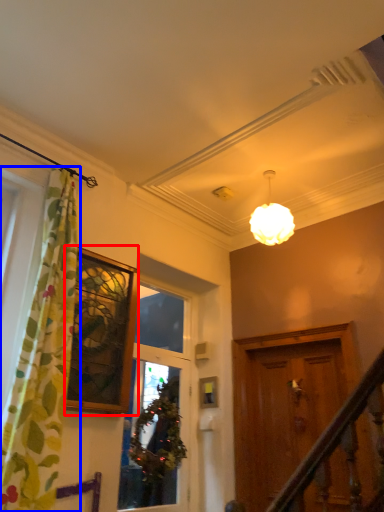
Question: Among these objects, which one is nearest to the camera, window (highlighted by a red box) or curtain (highlighted by a blue box)?

Choices:
 (A) window
 (B) curtain

Answer: (B)